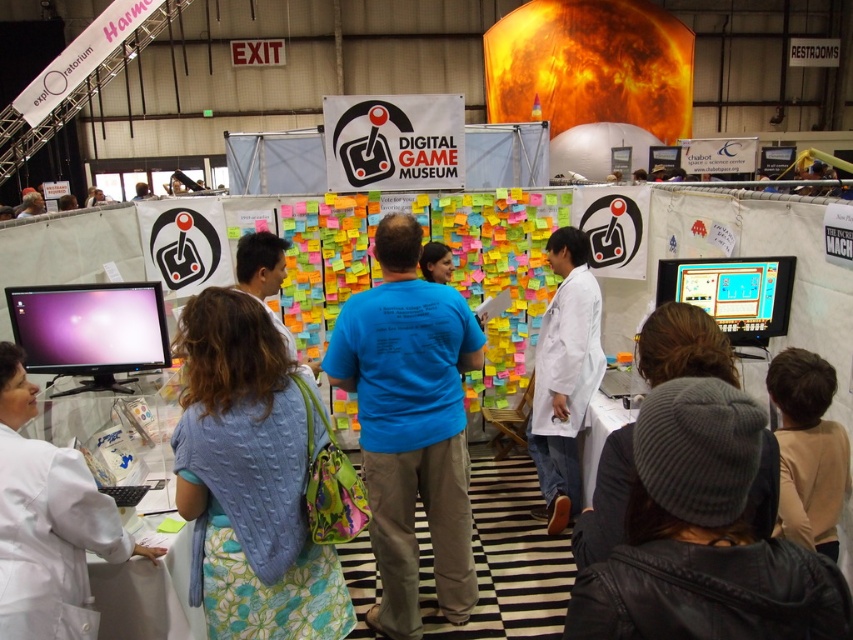
Does gray knit hat at lower right have a larger size compared to matte black monitor at lower left?

No, gray knit hat at lower right is not bigger than matte black monitor at lower left.

Locate an element on the screen. This screenshot has width=853, height=640. gray knit hat at lower right is located at coordinates (701, 536).

Who is more forward, (640,605) or (36,285)?

Positioned in front is point (640,605).

Locate an element on the screen. The height and width of the screenshot is (640, 853). gray knit hat at lower right is located at coordinates (701, 536).

Who is taller, white lab coat at left or white lab coat at center?

With more height is white lab coat at center.

Is white lab coat at left shorter than white lab coat at center?

Yes, white lab coat at left is shorter than white lab coat at center.

Who is more forward, [15,470] or [547,308]?

Positioned in front is point [15,470].

Where is `white lab coat at left`? white lab coat at left is located at coordinates pyautogui.click(x=48, y=524).

Where is `blue cotton t-shirt at center`? This screenshot has width=853, height=640. blue cotton t-shirt at center is located at coordinates (410, 424).

Does blue cotton t-shirt at center appear on the left side of matte plastic computer monitor at center?

Indeed, blue cotton t-shirt at center is positioned on the left side of matte plastic computer monitor at center.

Who is more forward, (431, 365) or (737, 342)?

Positioned in front is point (431, 365).

Image resolution: width=853 pixels, height=640 pixels. I want to click on blue cotton t-shirt at center, so click(x=410, y=424).